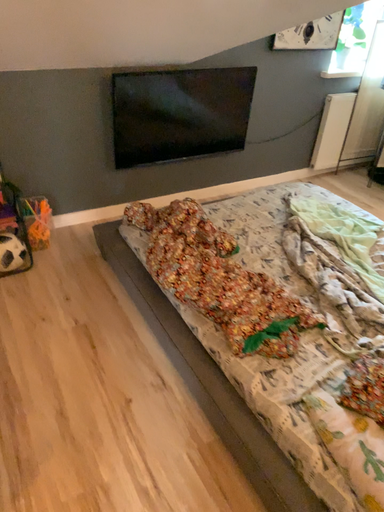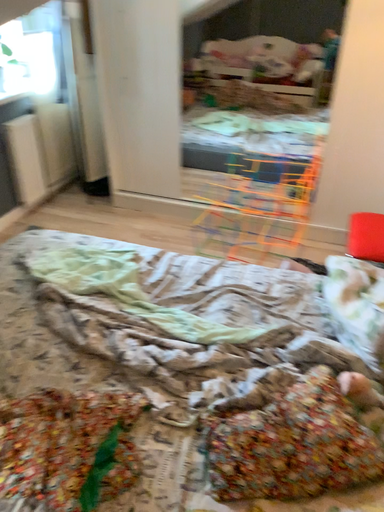
Question: How did the camera likely rotate when shooting the video?

Choices:
 (A) rotated upward
 (B) rotated downward

Answer: (A)